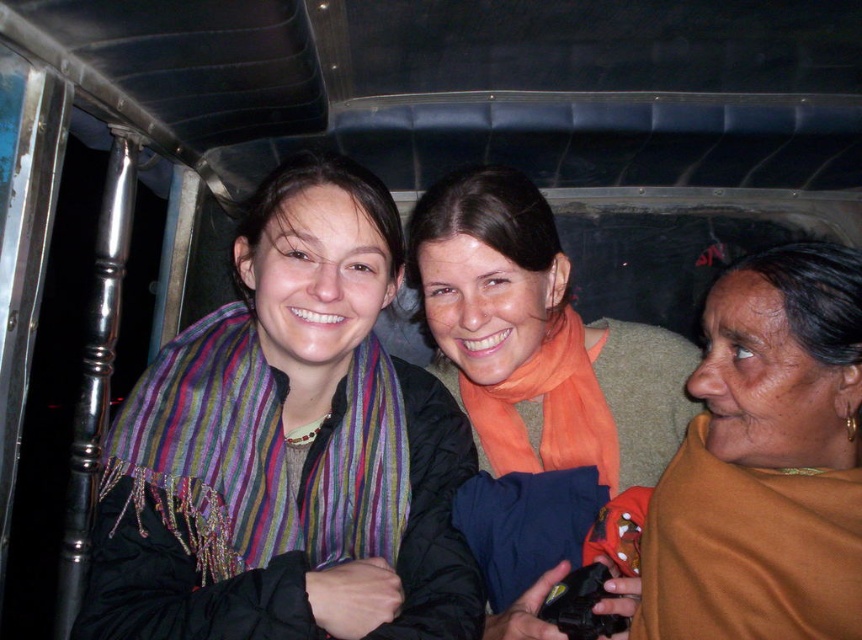
You are a photographer trying to capture a closeup of the multicolored woven scarf at left and the orange silk scarf at center. Since the lighting is dim, you need to adjust your camera settings. Which scarf will require a larger aperture to ensure proper exposure?

The multicolored woven scarf at left is bigger than the orange silk scarf at center, so it will require a larger aperture to ensure proper exposure.